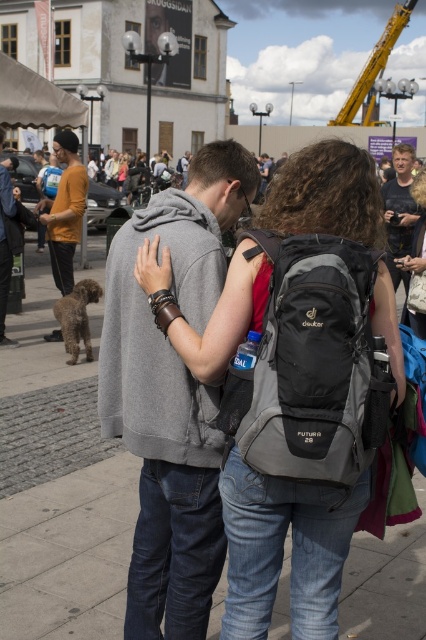
Which is behind, point (259, 454) or point (58, 161)?

Point (58, 161)

Between point (253, 371) and point (71, 284), which one is positioned in front?

Point (253, 371) is in front.

Who is more forward, (319, 314) or (85, 177)?

Point (319, 314) is in front.

The height and width of the screenshot is (640, 426). I want to click on gray fabric backpack at center, so click(x=310, y=365).

Between gray fabric backpack at center and dark gray hoodie at center, which one has less height?

dark gray hoodie at center

Who is more forward, (350, 317) or (2, 269)?

Positioned in front is point (350, 317).

At what (x,y) coordinates should I click in order to perform the action: click on gray fabric backpack at center. Please return your answer as a coordinate pair (x, y). Image resolution: width=426 pixels, height=640 pixels. Looking at the image, I should click on (310, 365).

Which is more to the left, denim backpack at center or matte black backpack at center?

denim backpack at center is more to the left.

Between denim backpack at center and matte black backpack at center, which one has less height?

With less height is matte black backpack at center.

Who is more forward, (232, 348) or (411, 314)?

Point (232, 348) is more forward.

At what (x,y) coordinates should I click in order to perform the action: click on denim backpack at center. Please return your answer as a coordinate pair (x, y). Looking at the image, I should click on (296, 381).